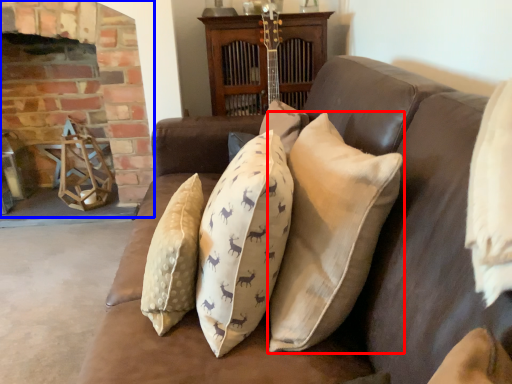
Question: Which object is closer to the camera taking this photo, pillow (highlighted by a red box) or fireplace (highlighted by a blue box)?

Choices:
 (A) pillow
 (B) fireplace

Answer: (A)